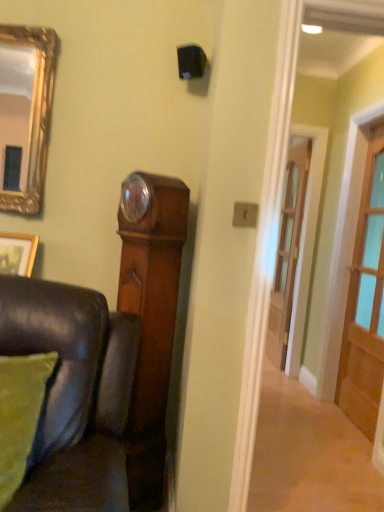
Question: Can you confirm if wooden door at right, acting as the 2th door starting from the back, is positioned to the left of wooden picture frame at lower left?

Choices:
 (A) yes
 (B) no

Answer: (B)

Question: Is wooden door at right, acting as the 2th door starting from the back, facing away from wooden picture frame at lower left?

Choices:
 (A) no
 (B) yes

Answer: (A)

Question: Considering the relative sizes of wooden door at right, which is counted as the 2th door, starting from the left, and wooden picture frame at lower left in the image provided, is wooden door at right, which is counted as the 2th door, starting from the left, taller than wooden picture frame at lower left?

Choices:
 (A) no
 (B) yes

Answer: (B)

Question: Considering the relative sizes of wooden door at right, which is counted as the 2th door, starting from the left, and wooden picture frame at lower left in the image provided, is wooden door at right, which is counted as the 2th door, starting from the left, thinner than wooden picture frame at lower left?

Choices:
 (A) yes
 (B) no

Answer: (B)

Question: Are wooden door at right, which is counted as the 2th door, starting from the left, and wooden picture frame at lower left beside each other?

Choices:
 (A) no
 (B) yes

Answer: (A)

Question: From a real-world perspective, is wooden door at right, marked as the first door in a right-to-left arrangement, over wooden picture frame at lower left?

Choices:
 (A) yes
 (B) no

Answer: (A)

Question: Is wooden door at center, the 1th door positioned from the back, wider than wooden door at right, acting as the 2th door starting from the back?

Choices:
 (A) no
 (B) yes

Answer: (A)

Question: Is wooden door at center, the 2th door viewed from the right, facing away from wooden door at right, the first door positioned from the front?

Choices:
 (A) yes
 (B) no

Answer: (B)

Question: Is wooden door at center, the second door from the front, next to wooden door at right, acting as the 2th door starting from the back, and touching it?

Choices:
 (A) yes
 (B) no

Answer: (B)

Question: From a real-world perspective, is wooden door at center, arranged as the 1th door when viewed from the left, positioned over wooden door at right, which is counted as the 2th door, starting from the left, based on gravity?

Choices:
 (A) no
 (B) yes

Answer: (A)

Question: Is wooden door at center, the second door from the front, smaller than wooden door at right, marked as the first door in a right-to-left arrangement?

Choices:
 (A) no
 (B) yes

Answer: (B)

Question: Can you confirm if wooden door at center, the second door from the front, is positioned to the right of wooden door at right, the first door positioned from the front?

Choices:
 (A) no
 (B) yes

Answer: (A)

Question: From the image's perspective, is wooden door at right, marked as the first door in a right-to-left arrangement, located above green fabric pillow at lower left?

Choices:
 (A) no
 (B) yes

Answer: (B)